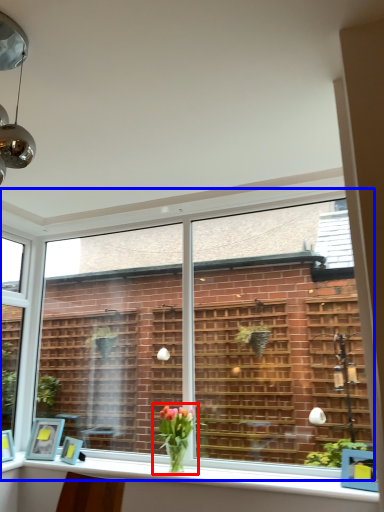
Question: Which of the following is the closest to the observer, houseplant (highlighted by a red box) or window (highlighted by a blue box)?

Choices:
 (A) houseplant
 (B) window

Answer: (B)